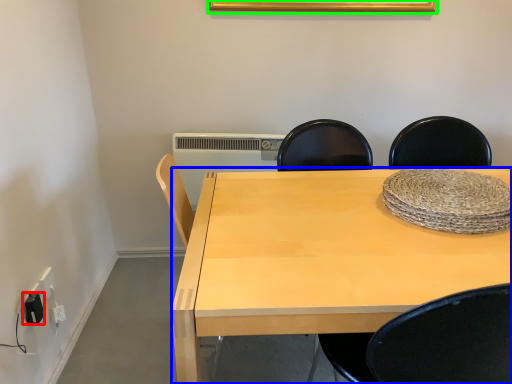
Question: Considering the real-world distances, which object is closest to electric outlet (highlighted by a red box)? desk (highlighted by a blue box) or picture frame (highlighted by a green box).

Choices:
 (A) desk
 (B) picture frame

Answer: (A)